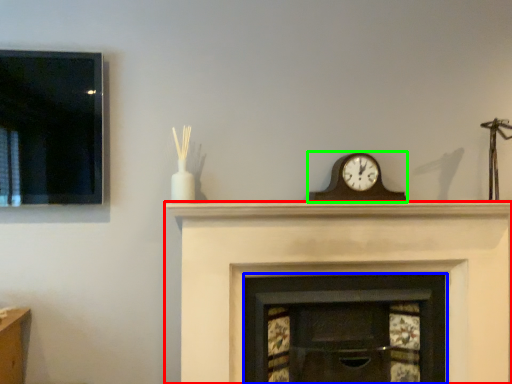
Question: Estimate the real-world distances between objects in this image. Which object is closer to fireplace (highlighted by a red box), fireplace (highlighted by a blue box) or wall clock (highlighted by a green box)?

Choices:
 (A) fireplace
 (B) wall clock

Answer: (A)